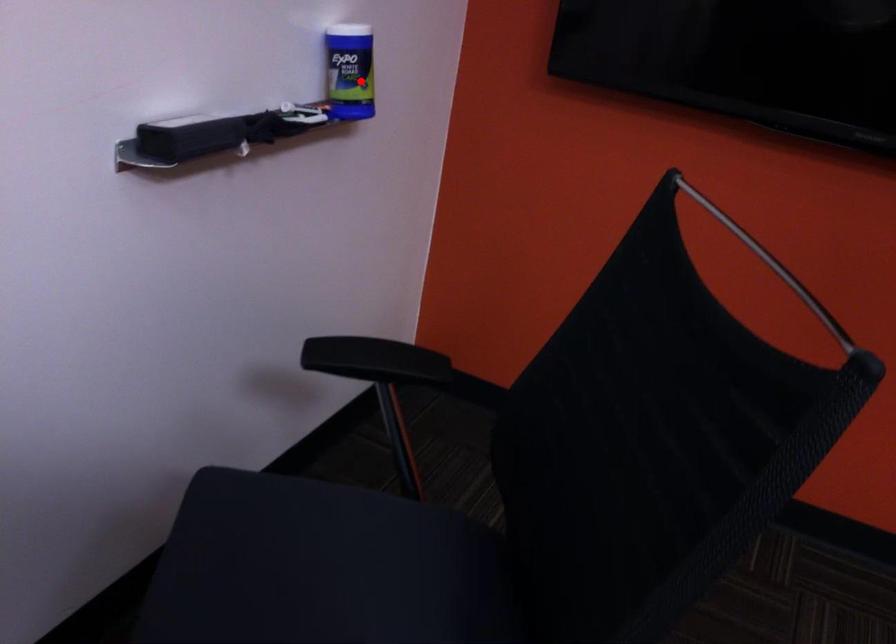
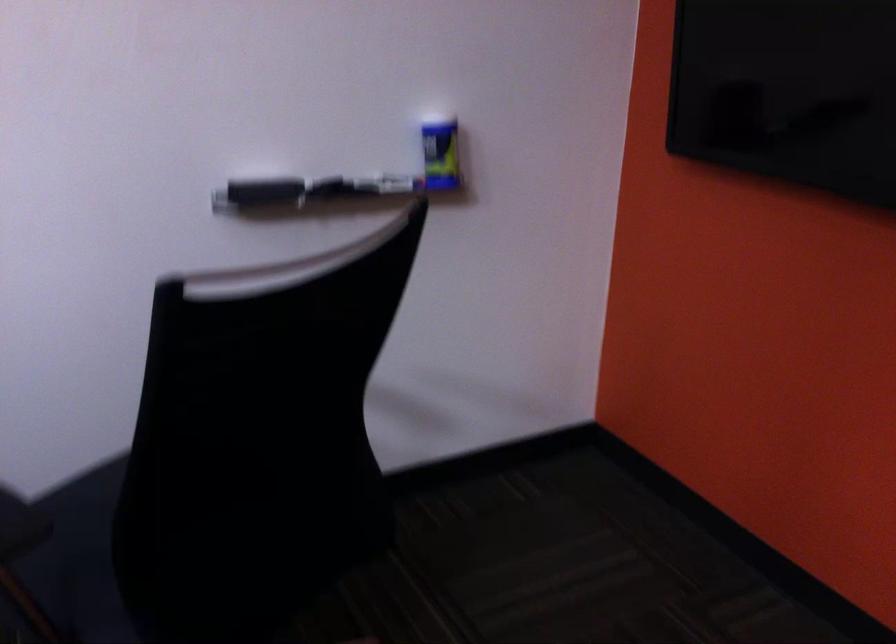
The point at the highlighted location is marked in the first image. Where is the corresponding point in the second image?

(440, 156)